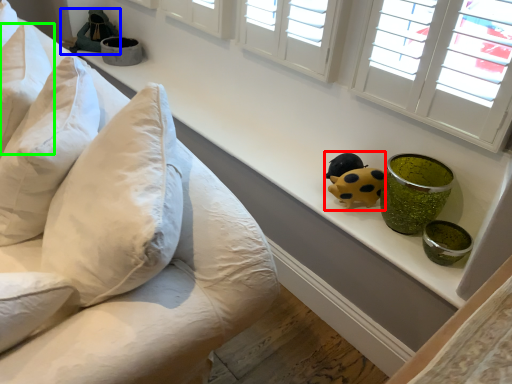
Question: Which object is the farthest from toy (highlighted by a red box)? Choose among these: toy (highlighted by a blue box) or pillow (highlighted by a green box).

Choices:
 (A) toy
 (B) pillow

Answer: (A)